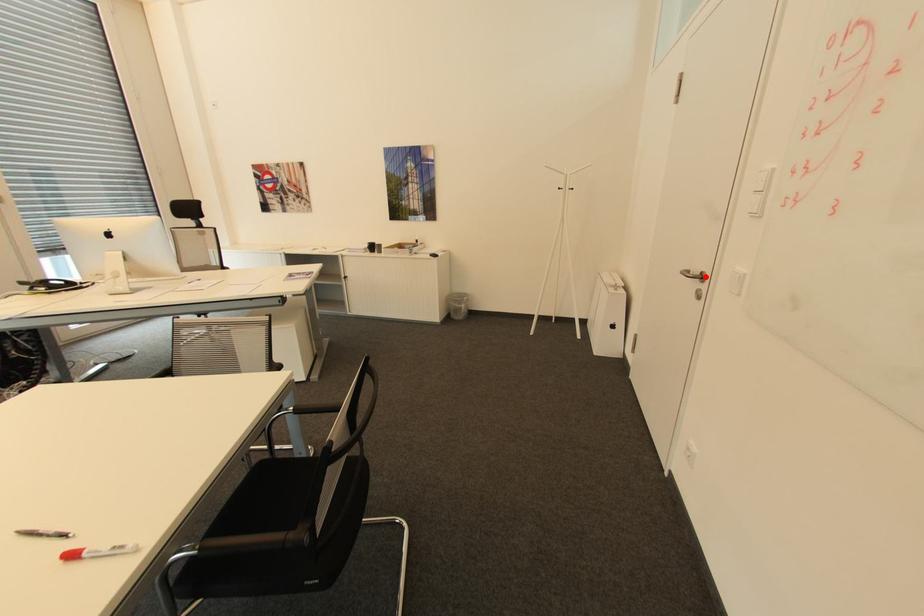
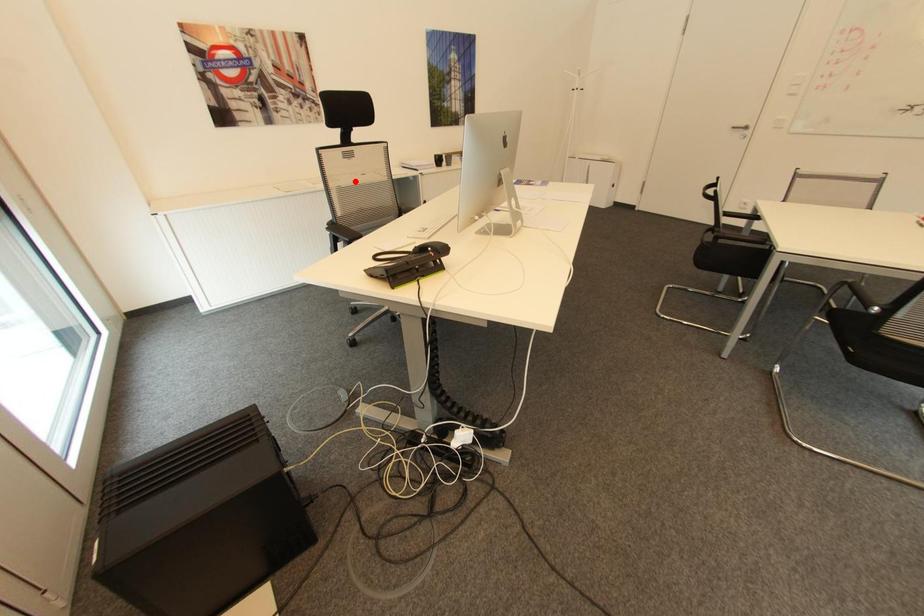
I am providing you with two images of the same scene from different viewpoints. A red point is marked on the first image and another point is marked on the second image. Are the points marked in image1 and image2 representing the same 3D position?

No